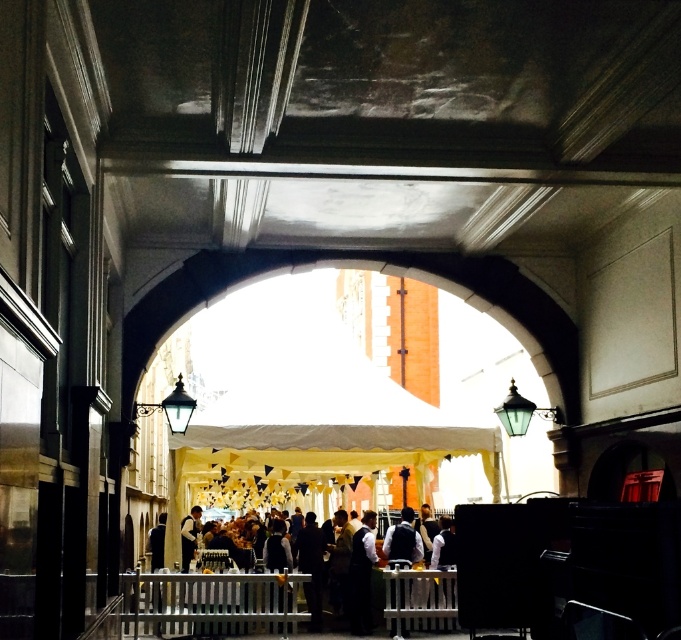
Does dark gray suit at center lie behind white shirt at center?

That is False.

Is point (308, 529) farther from viewer compared to point (183, 556)?

That is False.

Where is `dark gray suit at center`? dark gray suit at center is located at coordinates (413, 596).